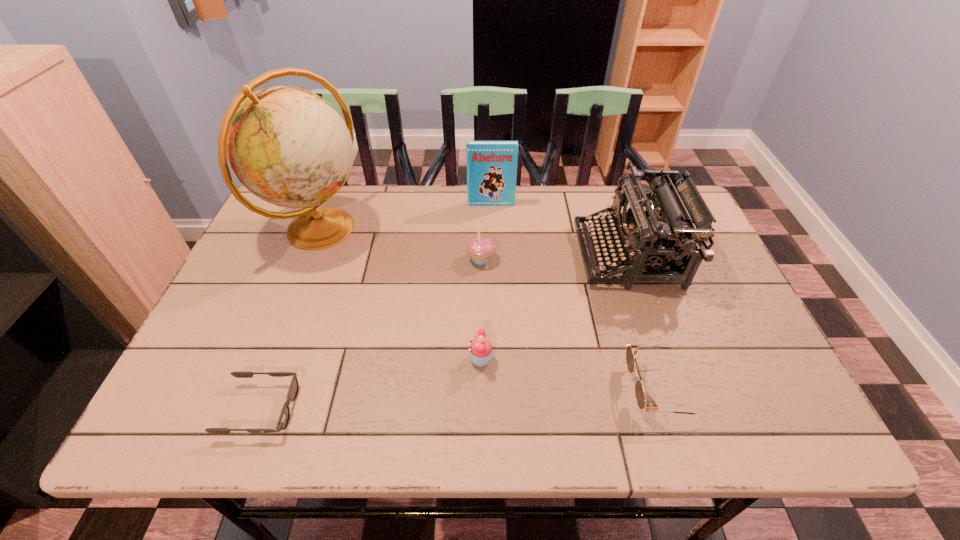
The width and height of the screenshot is (960, 540). I want to click on the tallest object, so click(x=288, y=146).

Where is `book`? The height and width of the screenshot is (540, 960). book is located at coordinates click(x=491, y=165).

Image resolution: width=960 pixels, height=540 pixels. Identify the location of typewriter. (651, 238).

Image resolution: width=960 pixels, height=540 pixels. In order to click on the farther cupcake in this screenshot , I will do `click(480, 248)`.

The image size is (960, 540). Find the location of `the fourth shortest object`. the fourth shortest object is located at coordinates (480, 248).

I want to click on the shorter cupcake, so click(480, 352).

This screenshot has width=960, height=540. I want to click on the right sunglasses, so click(x=631, y=350).

What are the coordinates of `the shorter sunglasses` in the screenshot? It's located at (283, 420).

At what (x,y) coordinates should I click in order to perform the action: click on the left sunglasses. Please return your answer as a coordinate pair (x, y). This screenshot has width=960, height=540. Looking at the image, I should click on (283, 420).

Where is `vacant space situated on the right of the globe`? vacant space situated on the right of the globe is located at coordinates (463, 229).